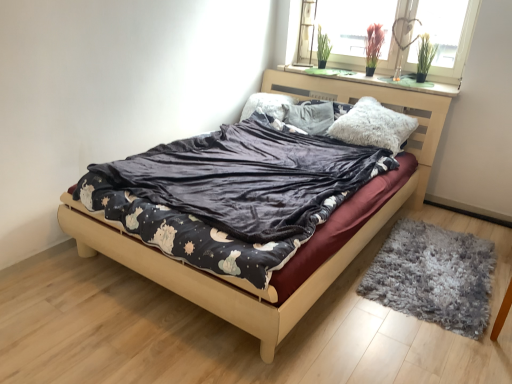
Question: Considering the positions of point (394, 283) and point (462, 26), is point (394, 283) closer or farther from the camera than point (462, 26)?

Choices:
 (A) closer
 (B) farther

Answer: (A)

Question: In the image, is gray shaggy rug at lower right positioned in front of or behind glass window at upper right?

Choices:
 (A) front
 (B) behind

Answer: (A)

Question: Considering the real-world distances, which object is closest to the gray shaggy rug at lower right?

Choices:
 (A) velvet dark gray blanket at center
 (B) fluffy white pillow at center, the first pillow from the right
 (C) fluffy white pillow at upper center, the 2th pillow from the right
 (D) velvet dark blue bed at center
 (E) glass window at upper right

Answer: (D)

Question: Based on their relative distances, which object is farther from the fluffy white pillow at center, the 2th pillow positioned from the left?

Choices:
 (A) gray shaggy rug at lower right
 (B) fluffy white pillow at upper center, the 2th pillow from the right
 (C) glass window at upper right
 (D) velvet dark gray blanket at center
 (E) velvet dark blue bed at center

Answer: (E)